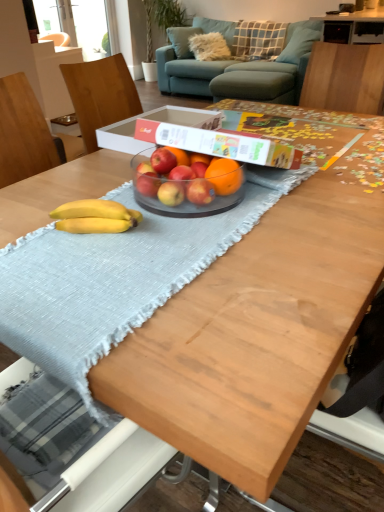
In order to click on free point in front of yellow matte apple at center, the 3th apple in the right-to-left sequence in this screenshot , I will do `click(161, 237)`.